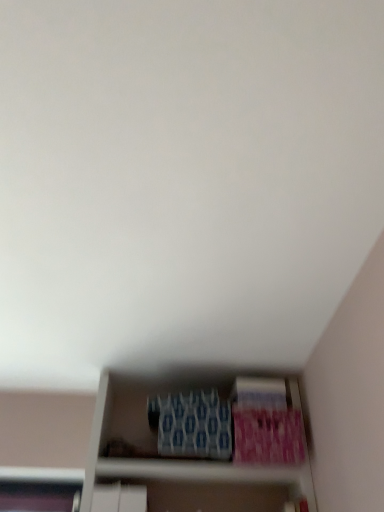
Question: Should I look upward or downward to see blue textured paperback book at center, the 1th paperback book in the left-to-right sequence?

Choices:
 (A) down
 (B) up

Answer: (A)

Question: Does pink matte paperback book at lower right, which appears as the first paperback book when viewed from the right, appear on the right side of blue textured paperback book at center, the 3th paperback book in the right-to-left sequence?

Choices:
 (A) no
 (B) yes

Answer: (B)

Question: Does pink matte paperback book at lower right, which is the 3th paperback book in left-to-right order, have a greater height compared to blue textured paperback book at center, the 1th paperback book in the left-to-right sequence?

Choices:
 (A) no
 (B) yes

Answer: (A)

Question: Is pink matte paperback book at lower right, which appears as the first paperback book when viewed from the right, further to the viewer compared to blue textured paperback book at center, the 3th paperback book in the right-to-left sequence?

Choices:
 (A) no
 (B) yes

Answer: (B)

Question: Is pink matte paperback book at lower right, which appears as the first paperback book when viewed from the right, oriented away from blue textured paperback book at center, the 3th paperback book in the right-to-left sequence?

Choices:
 (A) no
 (B) yes

Answer: (A)

Question: Is pink matte paperback book at lower right, which appears as the first paperback book when viewed from the right, closer to camera compared to blue textured paperback book at center, the 1th paperback book in the left-to-right sequence?

Choices:
 (A) no
 (B) yes

Answer: (A)

Question: From the image's perspective, is pink matte paperback book at lower right, which appears as the first paperback book when viewed from the right, beneath blue textured paperback book at center, the 3th paperback book in the right-to-left sequence?

Choices:
 (A) yes
 (B) no

Answer: (A)

Question: Can you confirm if blue textured paperback book at center, the 3th paperback book in the right-to-left sequence, is smaller than pink matte paperback book at lower right, which is the 3th paperback book in left-to-right order?

Choices:
 (A) no
 (B) yes

Answer: (A)

Question: Is blue textured paperback book at center, the 1th paperback book in the left-to-right sequence, at the right side of pink matte paperback book at lower right, which is the 3th paperback book in left-to-right order?

Choices:
 (A) yes
 (B) no

Answer: (B)

Question: Is blue textured paperback book at center, the 3th paperback book in the right-to-left sequence, facing away from pink matte paperback book at lower right, which appears as the first paperback book when viewed from the right?

Choices:
 (A) no
 (B) yes

Answer: (A)

Question: Is blue textured paperback book at center, the 3th paperback book in the right-to-left sequence, placed right next to pink matte paperback book at lower right, which is the 3th paperback book in left-to-right order?

Choices:
 (A) no
 (B) yes

Answer: (A)

Question: Is blue textured paperback book at center, the 3th paperback book in the right-to-left sequence, far from pink matte paperback book at lower right, which is the 3th paperback book in left-to-right order?

Choices:
 (A) yes
 (B) no

Answer: (B)

Question: Is blue textured paperback book at center, the 3th paperback book in the right-to-left sequence, positioned beyond the bounds of pink matte paperback book at lower right, which appears as the first paperback book when viewed from the right?

Choices:
 (A) yes
 (B) no

Answer: (A)

Question: Is pink matte paperback book at lower right, which appears as the first paperback book when viewed from the right, placed right next to blue textured paperback book at lower center, the second paperback book viewed from the left?

Choices:
 (A) no
 (B) yes

Answer: (B)